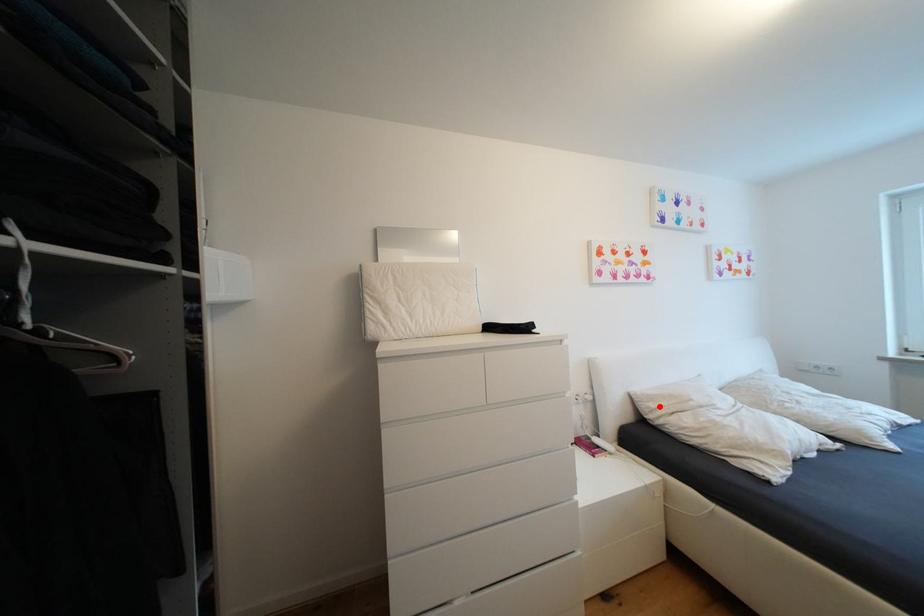
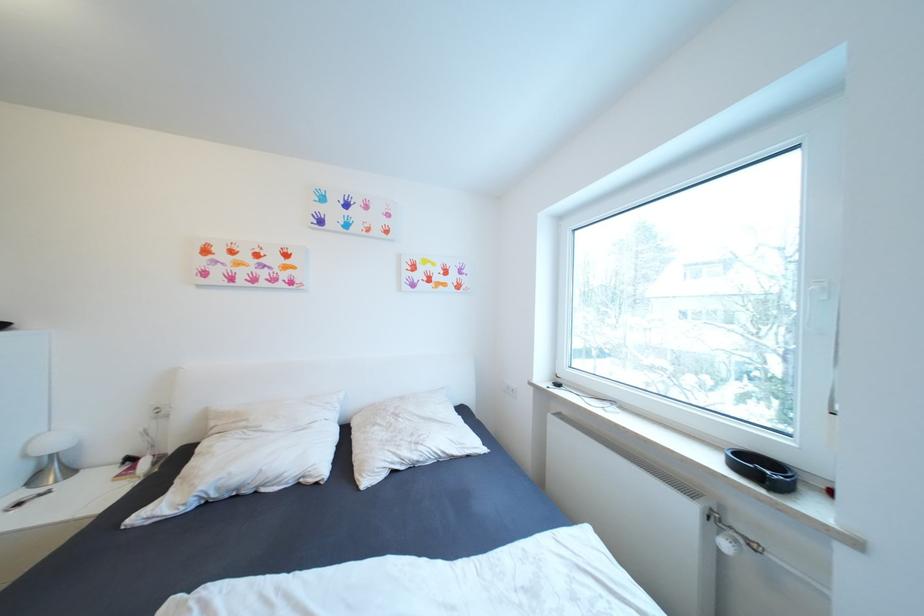
In the second image, find the point that corresponds to the highlighted location in the first image.

(220, 424)